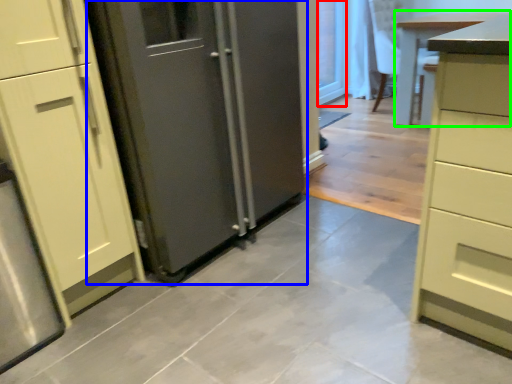
Question: Which object is positioned farthest from glass door (highlighted by a red box)? Select from door (highlighted by a blue box) and table (highlighted by a green box).

Choices:
 (A) door
 (B) table

Answer: (A)